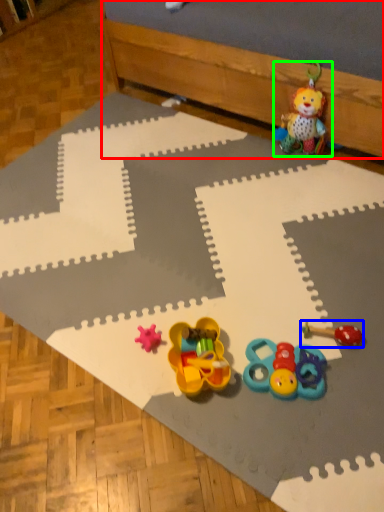
Question: Based on their relative distances, which object is farther from bed frame (highlighted by a red box)? Choose from toy (highlighted by a blue box) and toy (highlighted by a green box).

Choices:
 (A) toy
 (B) toy

Answer: (A)